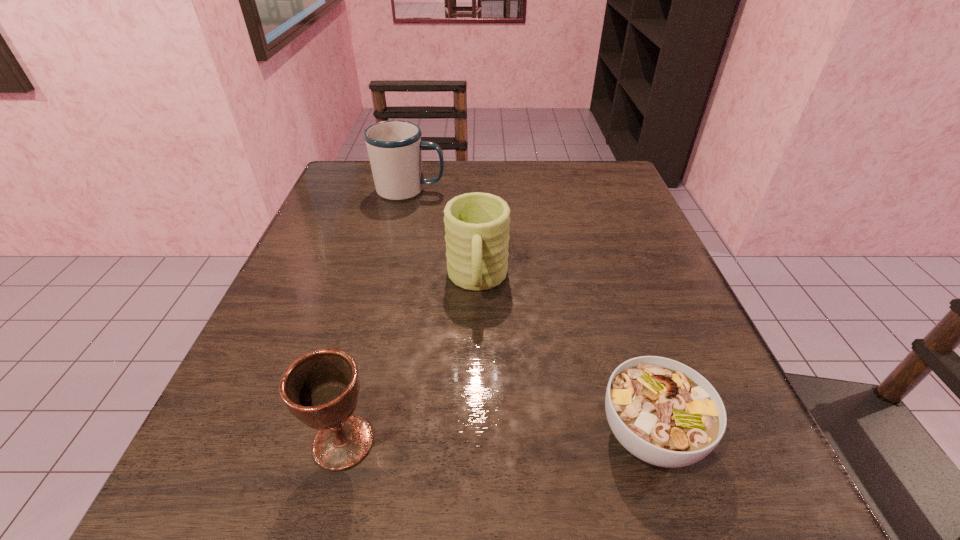
Identify the location of vacant space that satisfies the following two spatial constraints: 1. on the handle side of the farthest object; 2. on the right side of the shortest object. This screenshot has height=540, width=960. (351, 434).

Image resolution: width=960 pixels, height=540 pixels. Find the location of `free space that satisfies the following two spatial constraints: 1. on the handle side of the farthest object; 2. on the left side of the soup bowl`. free space that satisfies the following two spatial constraints: 1. on the handle side of the farthest object; 2. on the left side of the soup bowl is located at coordinates coord(351,434).

Locate an element on the screen. This screenshot has width=960, height=540. vacant space that satisfies the following two spatial constraints: 1. on the handle side of the farther mug; 2. on the back side of the rightmost object is located at coordinates (351, 434).

Locate an element on the screen. The height and width of the screenshot is (540, 960). vacant space that satisfies the following two spatial constraints: 1. on the handle side of the farthest object; 2. on the front side of the chalice is located at coordinates (349, 442).

This screenshot has width=960, height=540. Identify the location of free space that satisfies the following two spatial constraints: 1. on the handle side of the farthest object; 2. on the back side of the rightmost object. (351, 434).